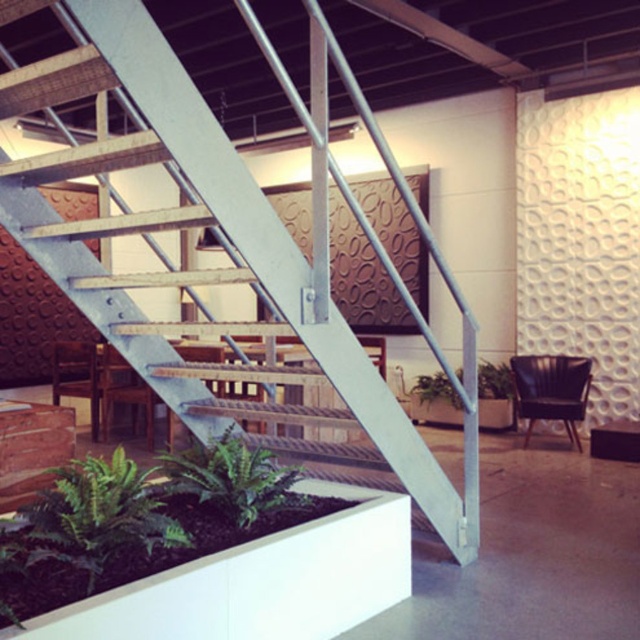
Question: Is metallic staircase at center to the left of black leather chair at right from the viewer's perspective?

Choices:
 (A) yes
 (B) no

Answer: (A)

Question: Among these points, which one is nearest to the camera?

Choices:
 (A) (259, 470)
 (B) (148, 33)

Answer: (B)

Question: Can you confirm if metallic staircase at center is bigger than wooden chair at center?

Choices:
 (A) yes
 (B) no

Answer: (A)

Question: Does metallic staircase at center appear on the left side of black leather chair at right?

Choices:
 (A) no
 (B) yes

Answer: (B)

Question: Which object is farther from the camera taking this photo?

Choices:
 (A) metallic staircase at center
 (B) wooden chair at lower left
 (C) wooden chair at center

Answer: (B)

Question: Which object is farther from the camera taking this photo?

Choices:
 (A) green leafy plant at lower left
 (B) green leafy plant at lower center
 (C) green leafy plant at center

Answer: (C)